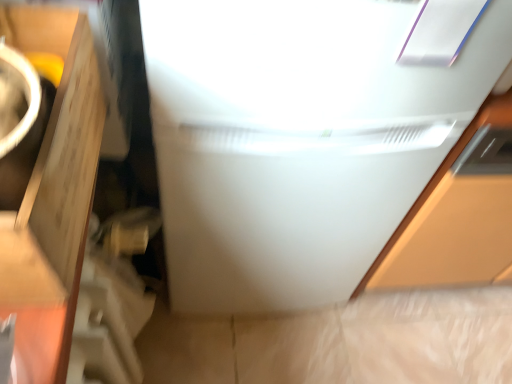
Question: Is point (207, 200) closer or farther from the camera than point (24, 299)?

Choices:
 (A) farther
 (B) closer

Answer: (A)

Question: In the image, is white glossy refrigerator at center on the left side or the right side of matte brown cardboard at left?

Choices:
 (A) right
 (B) left

Answer: (A)

Question: From a real-world perspective, is white glossy refrigerator at center positioned above or below matte brown cardboard at left?

Choices:
 (A) below
 (B) above

Answer: (A)

Question: Is matte brown cardboard at left spatially inside white glossy refrigerator at center, or outside of it?

Choices:
 (A) inside
 (B) outside

Answer: (B)

Question: From a real-world perspective, is matte brown cardboard at left positioned above or below white glossy refrigerator at center?

Choices:
 (A) above
 (B) below

Answer: (A)

Question: Is matte brown cardboard at left taller or shorter than white glossy refrigerator at center?

Choices:
 (A) short
 (B) tall

Answer: (A)

Question: In the image, is matte brown cardboard at left positioned in front of or behind white glossy refrigerator at center?

Choices:
 (A) front
 (B) behind

Answer: (A)